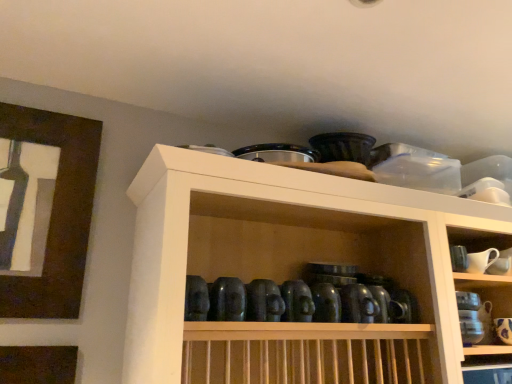
Question: Can you confirm if white ceramic pitcher at upper right, which is counted as the 1th tableware, starting from the left, is positioned to the left of brown wooden picture frame at upper left?

Choices:
 (A) yes
 (B) no

Answer: (B)

Question: Does white ceramic pitcher at upper right, which is counted as the 2th tableware, starting from the right, have a smaller size compared to brown wooden picture frame at upper left?

Choices:
 (A) no
 (B) yes

Answer: (B)

Question: Does white ceramic pitcher at upper right, which is counted as the 1th tableware, starting from the left, have a lesser width compared to brown wooden picture frame at upper left?

Choices:
 (A) no
 (B) yes

Answer: (A)

Question: Can you confirm if white ceramic pitcher at upper right, the second tableware from the bottom, is wider than brown wooden picture frame at upper left?

Choices:
 (A) yes
 (B) no

Answer: (A)

Question: Does white ceramic pitcher at upper right, the second tableware from the bottom, lie behind brown wooden picture frame at upper left?

Choices:
 (A) no
 (B) yes

Answer: (B)

Question: Would you say white glossy mug at upper right, marked as the second tableware in a top-to-bottom arrangement, is to the left or to the right of brown wooden picture frame at upper left in the picture?

Choices:
 (A) right
 (B) left

Answer: (A)

Question: Does point (501, 327) appear closer or farther from the camera than point (78, 206)?

Choices:
 (A) closer
 (B) farther

Answer: (B)

Question: Is white glossy mug at upper right, the first tableware when ordered from right to left, inside or outside of brown wooden picture frame at upper left?

Choices:
 (A) inside
 (B) outside

Answer: (B)

Question: From a real-world perspective, relative to brown wooden picture frame at upper left, is white glossy mug at upper right, the first tableware when ordered from right to left, vertically above or below?

Choices:
 (A) below
 (B) above

Answer: (A)

Question: Based on their sizes in the image, would you say matte black bowls at upper center is bigger or smaller than white glossy mug at upper right, the first tableware when ordered from right to left?

Choices:
 (A) big
 (B) small

Answer: (A)

Question: From the image's perspective, is matte black bowls at upper center positioned above or below white glossy mug at upper right, the 2th tableware positioned from the left?

Choices:
 (A) above
 (B) below

Answer: (A)

Question: Is matte black bowls at upper center to the left or to the right of white glossy mug at upper right, the 1th tableware in the bottom-to-top sequence, in the image?

Choices:
 (A) right
 (B) left

Answer: (B)

Question: Is matte black bowls at upper center inside the boundaries of white glossy mug at upper right, the 2th tableware positioned from the left, or outside?

Choices:
 (A) outside
 (B) inside

Answer: (A)

Question: Choose the correct answer: Is white ceramic pitcher at upper right, the first tableware viewed from the top, inside brown wooden picture frame at upper left or outside it?

Choices:
 (A) outside
 (B) inside

Answer: (A)

Question: Is white ceramic pitcher at upper right, which is counted as the 2th tableware, starting from the right, taller or shorter than brown wooden picture frame at upper left?

Choices:
 (A) short
 (B) tall

Answer: (A)